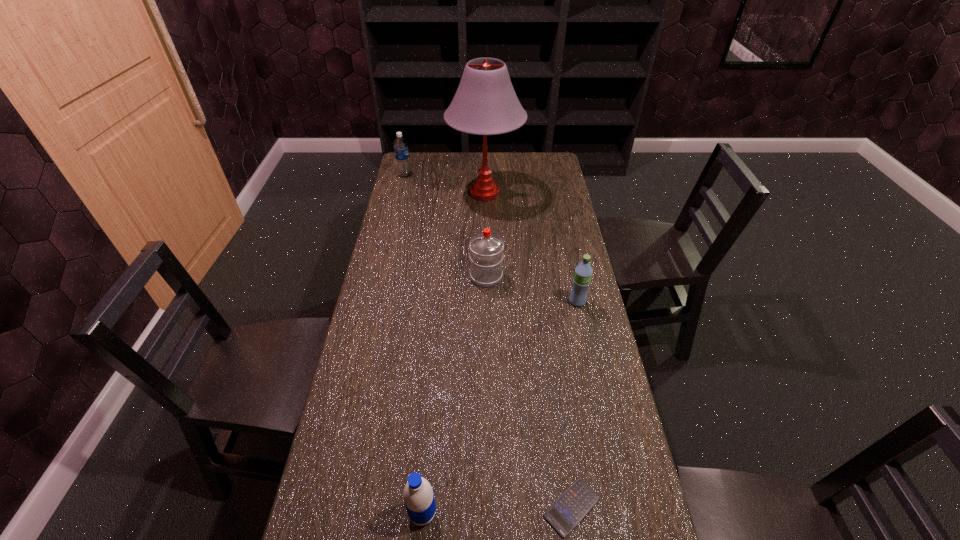
The width and height of the screenshot is (960, 540). Identify the location of vacant space located 0.100m on the front-facing side of the tallest object. (425, 193).

The height and width of the screenshot is (540, 960). Identify the location of free space located on the front-facing side of the tallest object. (414, 193).

Where is `free space located on the front of the farthest water bottle`? free space located on the front of the farthest water bottle is located at coordinates (402, 185).

Locate an element on the screen. vacant point located on the handle side of the second water bottle from right to left is located at coordinates (486, 222).

Identify the location of vacant space located on the handle side of the second water bottle from right to left. This screenshot has height=540, width=960. (486, 224).

Where is `vacant space located 0.350m on the handle side of the second water bottle from right to left`? vacant space located 0.350m on the handle side of the second water bottle from right to left is located at coordinates (485, 209).

Find the location of a particular element. The height and width of the screenshot is (540, 960). vacant point located 0.050m on the left of the fourth farthest object is located at coordinates (554, 301).

The image size is (960, 540). I want to click on vacant space located 0.120m on the left of the nearest water bottle, so click(x=356, y=514).

The height and width of the screenshot is (540, 960). I want to click on free location located 0.250m on the left of the shortest object, so click(x=433, y=508).

Find the location of a particular element. table lamp located in the far edge section of the desktop is located at coordinates (x=485, y=103).